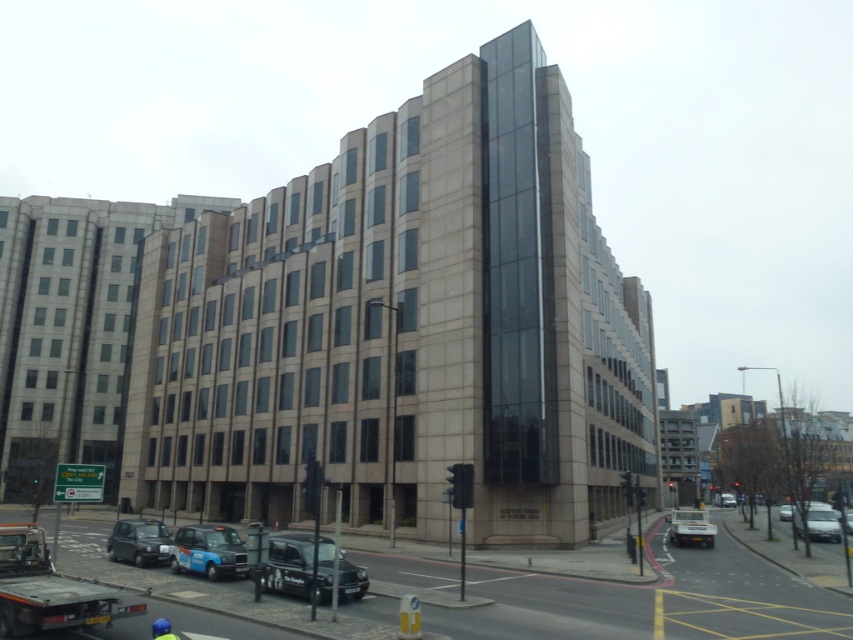
From the picture: Is matte black car at lower left shorter than metallic silver car at right?

Yes.

Which is in front, point (148, 545) or point (792, 506)?

Point (148, 545) is more forward.

Does point (163, 554) come behind point (782, 512)?

That is False.

Find the location of `matte black car at lower left`. matte black car at lower left is located at coordinates (138, 541).

Can you confirm if blue metallic taxi at lower center is positioned to the right of metallic silver car at right?

Incorrect, blue metallic taxi at lower center is not on the right side of metallic silver car at right.

Does point (195, 563) come farther from viewer compared to point (787, 513)?

That is False.

This screenshot has height=640, width=853. In order to click on blue metallic taxi at lower center in this screenshot , I will do `click(207, 552)`.

Is the position of black matte taxi at lower center more distant than that of metallic silver car at lower right?

No.

Is black matte taxi at lower center to the left of metallic silver car at lower right from the viewer's perspective?

Yes, black matte taxi at lower center is to the left of metallic silver car at lower right.

Measure the distance between point [302,572] and camera.

51.48 feet

Locate an element on the screen. Image resolution: width=853 pixels, height=640 pixels. black matte taxi at lower center is located at coordinates (288, 564).